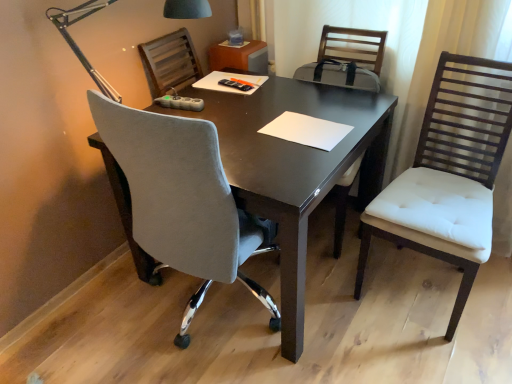
The image size is (512, 384). I want to click on vacant region to the right of white paper at center, so click(x=359, y=113).